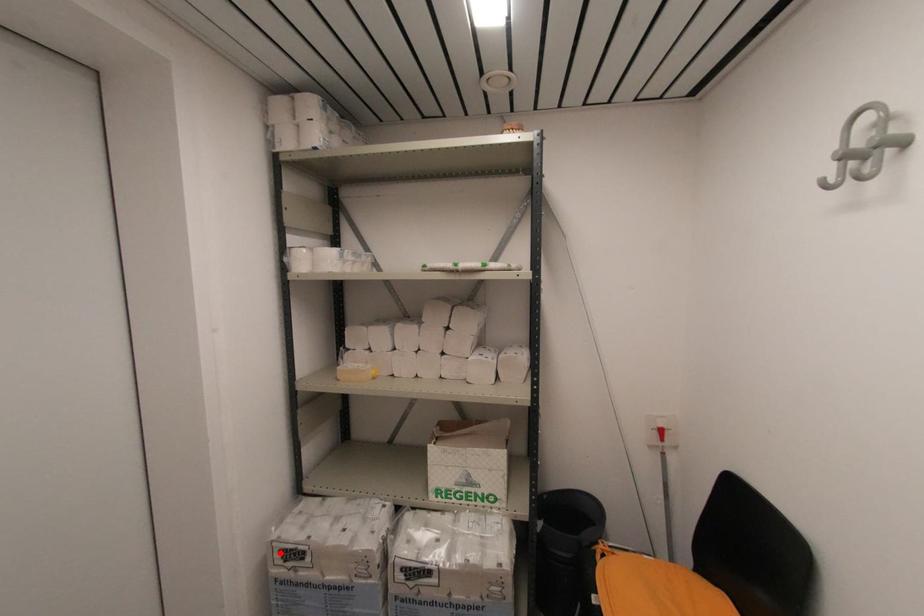
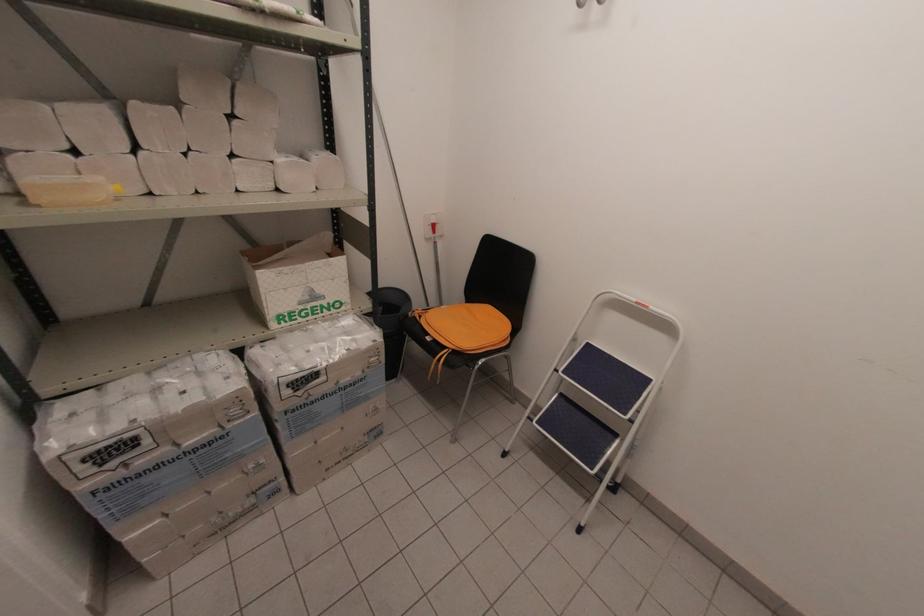
Question: I am providing you with two images of the same scene from different viewpoints. Given a red point in image1, look at the same physical point in image2. Is it:

Choices:
 (A) Closer to the viewpoint
 (B) Farther from the viewpoint

Answer: (A)